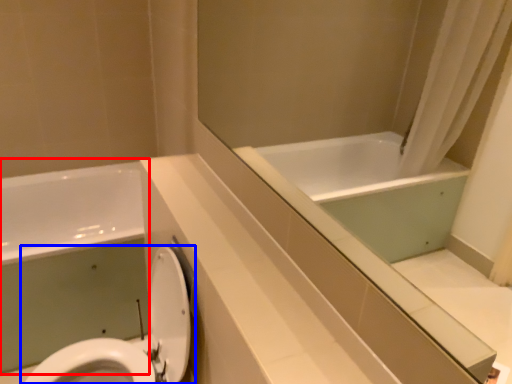
Question: Which object is further to the camera taking this photo, bath (highlighted by a red box) or toilet (highlighted by a blue box)?

Choices:
 (A) bath
 (B) toilet

Answer: (A)